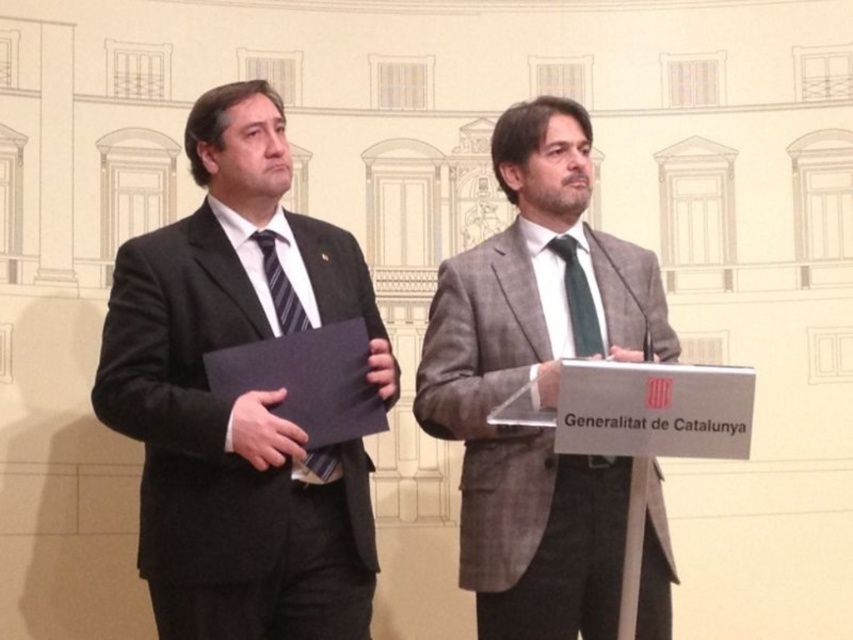
You are a photographer preparing to take a portrait of the two men in the scene. You notice the matte black suit at left and the striped fabric tie at left. Which object should you focus on first if you want to ensure both are in sharp focus, considering their sizes?

The matte black suit at left has a smaller size compared to the striped fabric tie at left, so focusing on the larger striped fabric tie at left would ensure both are in sharp focus.